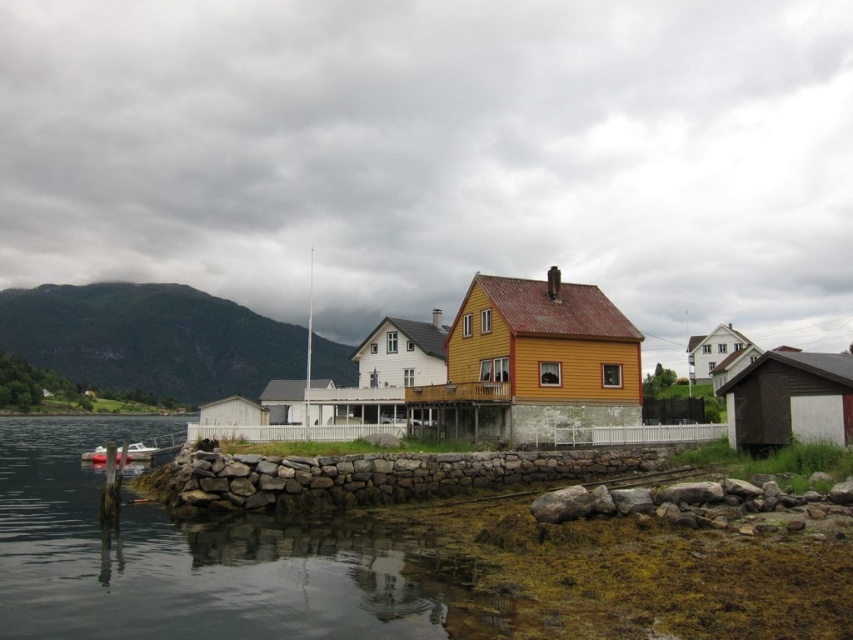
Question: Which point appears farthest from the camera in this image?

Choices:
 (A) (134, 458)
 (B) (281, 532)

Answer: (A)

Question: Among these points, which one is nearest to the camera?

Choices:
 (A) (80, 454)
 (B) (149, 605)

Answer: (B)

Question: Is clear water at lower left closer to the viewer compared to white plastic boat at lower left?

Choices:
 (A) yes
 (B) no

Answer: (A)

Question: Is clear water at lower left below white plastic boat at lower left?

Choices:
 (A) no
 (B) yes

Answer: (A)

Question: Does clear water at lower left appear under white plastic boat at lower left?

Choices:
 (A) yes
 (B) no

Answer: (B)